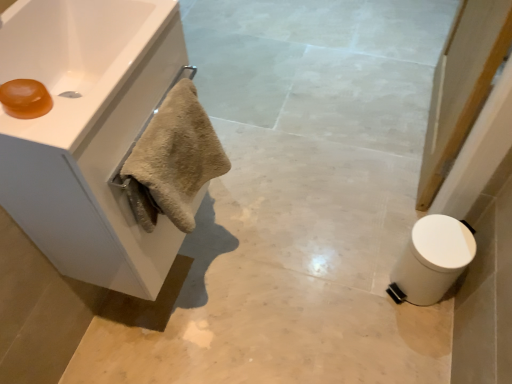
Question: From a real-world perspective, is white glossy sink at upper left on top of white marble towel at left?

Choices:
 (A) no
 (B) yes

Answer: (B)

Question: From the image's perspective, would you say white glossy sink at upper left is positioned over white marble towel at left?

Choices:
 (A) yes
 (B) no

Answer: (A)

Question: Is white glossy sink at upper left oriented away from white marble towel at left?

Choices:
 (A) yes
 (B) no

Answer: (B)

Question: Would you say white glossy sink at upper left is outside white marble towel at left?

Choices:
 (A) yes
 (B) no

Answer: (A)

Question: Is white glossy sink at upper left thinner than white marble towel at left?

Choices:
 (A) no
 (B) yes

Answer: (B)

Question: Considering the positions of beige fluffy towel at left and translucent amber soap at upper left in the image, is beige fluffy towel at left bigger or smaller than translucent amber soap at upper left?

Choices:
 (A) small
 (B) big

Answer: (B)

Question: From the image's perspective, is beige fluffy towel at left located above or below translucent amber soap at upper left?

Choices:
 (A) above
 (B) below

Answer: (B)

Question: Considering the positions of point (201, 178) and point (5, 89), is point (201, 178) closer or farther from the camera than point (5, 89)?

Choices:
 (A) farther
 (B) closer

Answer: (A)

Question: Is beige fluffy towel at left spatially inside translucent amber soap at upper left, or outside of it?

Choices:
 (A) outside
 (B) inside

Answer: (A)

Question: From a real-world perspective, is white marble towel at left above or below translucent amber soap at upper left?

Choices:
 (A) above
 (B) below

Answer: (B)

Question: Is white marble towel at left situated inside translucent amber soap at upper left or outside?

Choices:
 (A) inside
 (B) outside

Answer: (B)

Question: Looking at their shapes, would you say white marble towel at left is wider or thinner than translucent amber soap at upper left?

Choices:
 (A) thin
 (B) wide

Answer: (B)

Question: Considering the positions of white marble towel at left and translucent amber soap at upper left in the image, is white marble towel at left taller or shorter than translucent amber soap at upper left?

Choices:
 (A) short
 (B) tall

Answer: (B)

Question: From a real-world perspective, relative to white glossy sink at upper left, is beige fluffy towel at left vertically above or below?

Choices:
 (A) below
 (B) above

Answer: (A)

Question: In terms of size, does beige fluffy towel at left appear bigger or smaller than white glossy sink at upper left?

Choices:
 (A) big
 (B) small

Answer: (B)